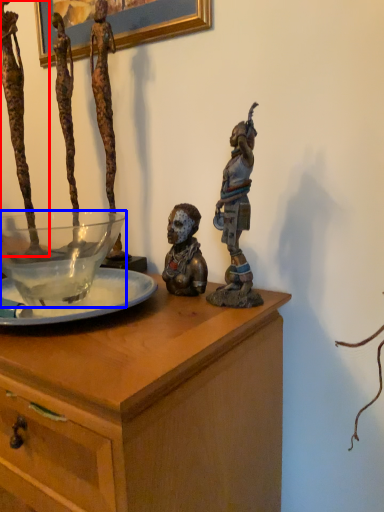
Question: Which point is closer to the camera, person (highlighted by a red box) or glass bowl (highlighted by a blue box)?

Choices:
 (A) person
 (B) glass bowl

Answer: (B)